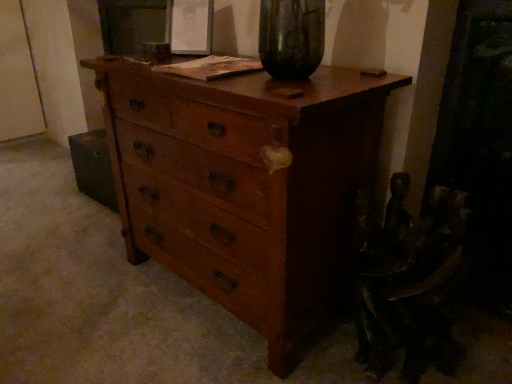
Identify the location of wooden swivel chair at lower right. (410, 283).

Describe the element at coordinates (410, 283) in the screenshot. I see `wooden swivel chair at lower right` at that location.

Where is `wooden chest of drawers at center`? The width and height of the screenshot is (512, 384). wooden chest of drawers at center is located at coordinates (245, 184).

The image size is (512, 384). Describe the element at coordinates (245, 184) in the screenshot. I see `wooden chest of drawers at center` at that location.

Measure the distance between wooden chest of drawers at center and camera.

wooden chest of drawers at center is 35.28 inches away from camera.

In order to click on wooden swivel chair at lower right in this screenshot , I will do pyautogui.click(x=410, y=283).

Between wooden swivel chair at lower right and wooden chest of drawers at center, which one appears on the right side from the viewer's perspective?

wooden swivel chair at lower right is more to the right.

Which object is further away from the camera, wooden swivel chair at lower right or wooden chest of drawers at center?

Positioned behind is wooden swivel chair at lower right.

Which is closer to the camera, (436, 204) or (190, 281)?

The point (436, 204) is more forward.

From the image's perspective, does wooden swivel chair at lower right appear higher than wooden chest of drawers at center?

No.

From a real-world perspective, relative to wooden chest of drawers at center, is wooden swivel chair at lower right vertically above or below?

wooden swivel chair at lower right is situated lower than wooden chest of drawers at center in the real world.

Considering the sizes of objects wooden swivel chair at lower right and wooden chest of drawers at center in the image provided, who is wider, wooden swivel chair at lower right or wooden chest of drawers at center?

wooden chest of drawers at center.

Which of these two, wooden swivel chair at lower right or wooden chest of drawers at center, stands taller?

wooden chest of drawers at center.

Based on the photo, is wooden swivel chair at lower right smaller than wooden chest of drawers at center?

Correct, wooden swivel chair at lower right occupies less space than wooden chest of drawers at center.

Is wooden swivel chair at lower right not inside wooden chest of drawers at center?

Absolutely, wooden swivel chair at lower right is external to wooden chest of drawers at center.

Would you say wooden swivel chair at lower right is a long distance from wooden chest of drawers at center?

No, wooden swivel chair at lower right is not far away from wooden chest of drawers at center.

From the picture: Is wooden swivel chair at lower right oriented towards wooden chest of drawers at center?

No, wooden swivel chair at lower right does not turn towards wooden chest of drawers at center.

How many degrees apart are the facing directions of wooden swivel chair at lower right and wooden chest of drawers at center?

There is a 0.00189-degree angle between the facing directions of wooden swivel chair at lower right and wooden chest of drawers at center.

Where is `chest of drawers above the wooden swivel chair at lower right (from a real-world perspective)`? The height and width of the screenshot is (384, 512). chest of drawers above the wooden swivel chair at lower right (from a real-world perspective) is located at coordinates click(x=245, y=184).

Which is more to the left, wooden chest of drawers at center or wooden swivel chair at lower right?

Positioned to the left is wooden chest of drawers at center.

Is the position of wooden chest of drawers at center more distant than that of wooden swivel chair at lower right?

No, it is not.

Which is closer, (x=182, y=254) or (x=428, y=316)?

Clearly, point (x=182, y=254) is more distant from the camera than point (x=428, y=316).

From the image's perspective, which one is positioned higher, wooden chest of drawers at center or wooden swivel chair at lower right?

wooden chest of drawers at center appears higher in the image.

Consider the image. From a real-world perspective, which is physically above, wooden chest of drawers at center or wooden swivel chair at lower right?

In real-world perspective, wooden chest of drawers at center is above.

Which of these two, wooden chest of drawers at center or wooden swivel chair at lower right, is wider?

wooden chest of drawers at center is wider.

Does wooden chest of drawers at center have a greater height compared to wooden swivel chair at lower right?

Yes.

Is wooden chest of drawers at center bigger than wooden swivel chair at lower right?

Yes.

Would you say wooden swivel chair at lower right is part of wooden chest of drawers at center's contents?

No, wooden swivel chair at lower right is not a part of wooden chest of drawers at center.

Is there a large distance between wooden chest of drawers at center and wooden swivel chair at lower right?

No.

Is wooden chest of drawers at center oriented towards wooden swivel chair at lower right?

No, wooden chest of drawers at center is not facing towards wooden swivel chair at lower right.

Locate an element on the screen. The image size is (512, 384). swivel chair on the right of wooden chest of drawers at center is located at coordinates (410, 283).

Identify the location of swivel chair to the right of wooden chest of drawers at center. This screenshot has height=384, width=512. tap(410, 283).

I want to click on the chest of drawers lying in front of the wooden swivel chair at lower right, so click(245, 184).